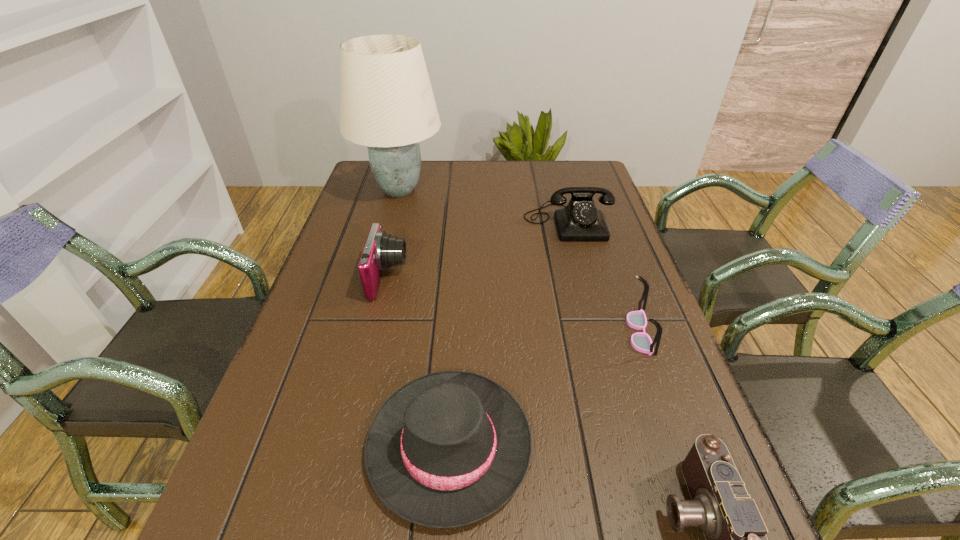
The width and height of the screenshot is (960, 540). I want to click on object that stands as the third closest to the lampshade, so click(x=446, y=450).

You are a GUI agent. You are given a task and a screenshot of the screen. Output one action in this format:
    pyautogui.click(x=<x>, y=<y>)
    Task: Click on the vacant space that satisfies the following two spatial constraints: 1. on the front-facing side of the left camera; 2. on the right side of the spectacles
    
    Given the screenshot: What is the action you would take?
    pyautogui.click(x=375, y=332)

Where is `free location that satisfies the following two spatial constraints: 1. on the front face of the telephone; 2. on the front-facing side of the fourth nearest object`? free location that satisfies the following two spatial constraints: 1. on the front face of the telephone; 2. on the front-facing side of the fourth nearest object is located at coordinates (583, 278).

I want to click on vacant space that satisfies the following two spatial constraints: 1. on the front face of the telephone; 2. on the front-facing side of the taller camera, so click(583, 278).

This screenshot has width=960, height=540. Identify the location of vacant position in the image that satisfies the following two spatial constraints: 1. on the front face of the telephone; 2. on the left side of the spectacles. (597, 332).

The width and height of the screenshot is (960, 540). In order to click on free space that satisfies the following two spatial constraints: 1. on the front face of the spectacles; 2. on the left side of the telephone in this screenshot , I will do `click(597, 332)`.

What are the coordinates of `free space that satisfies the following two spatial constraints: 1. on the front-facing side of the third nearest object; 2. on the left side of the farther camera` in the screenshot? It's located at (375, 332).